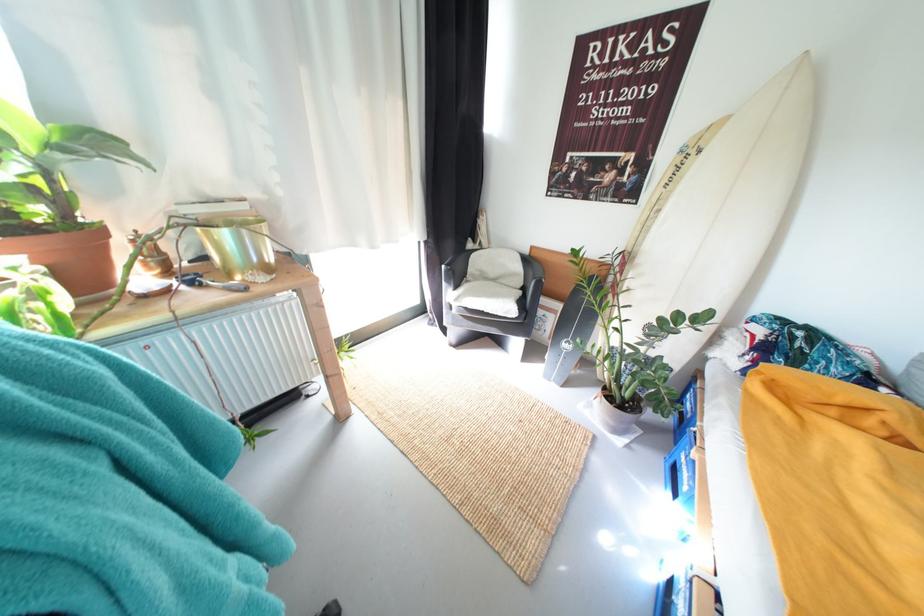
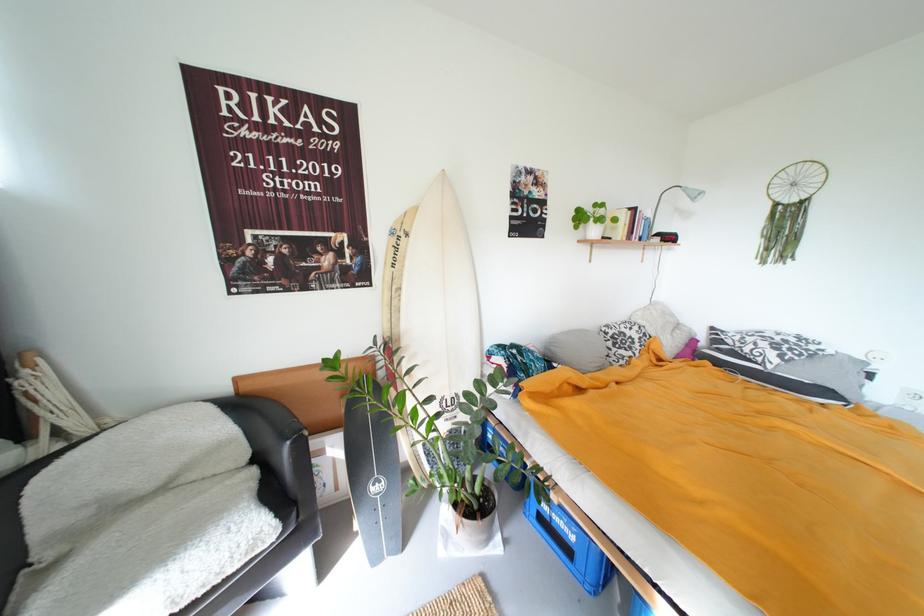
The point at (619,424) is marked in the first image. Where is the corresponding point in the second image?

(492, 539)